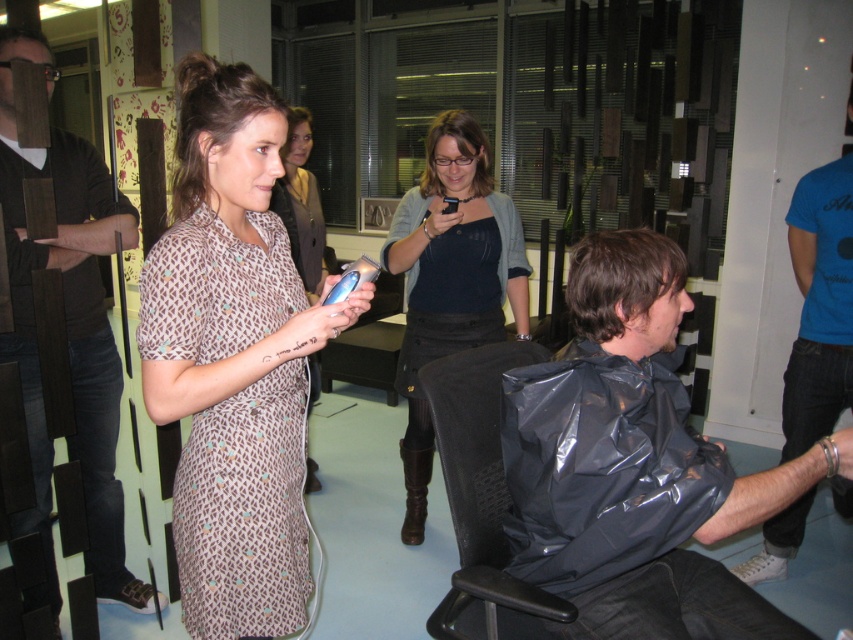
You are a person who wants to take a photo of the black mesh chair at lower center and the dark brown hair at right. Which object should you focus on first if you want to capture both in one frame without moving the camera?

The black mesh chair at lower center is located below dark brown hair at right, so you should focus on the dark brown hair at right first to ensure both are in frame.

In the scene described, there are two objects of interest. The first is a brown printed fabric dress at center, and the second is a black plastic chair at center. From the perspective of someone standing behind the woman holding the blue electric clipper, which object is positioned to the right?

The brown printed fabric dress at center is to the right of the black plastic chair at center, so from the perspective of someone standing behind the woman holding the blue electric clipper, the brown printed fabric dress at center would be on the right side.